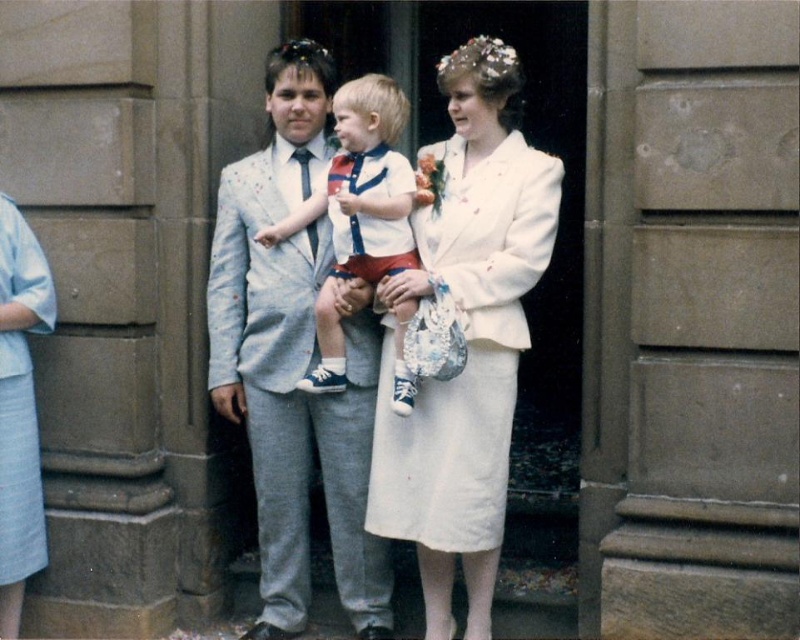
You are a photographer at a wedding and need to adjust your camera focus. The light gray suit at center is closer to you than the white satin dress at center. Which one should you focus on to ensure the subject in front is sharp?

You should focus on the light gray suit at center because it is closer to you, ensuring the subject in front is sharp.

You are a photographer at a wedding and need to ensure that both the light gray suit at center and the white satin dress at center are fully visible in the photo. Based on their positions, which one is lower and might be partially hidden if you adjust the camera angle downward?

The light gray suit at center is positioned under the white satin dress at center, so adjusting the camera angle downward might hide part of the light gray suit at center.

You are standing in front of the stone building and see two points marked in the image. The first point is at coordinate point (320, 209) and the second is at point (26, 577). If you want to touch both points with your finger, which point should you reach for first?

You should reach for point (320, 209) first because it is closer to you than point (26, 577), which is further away.